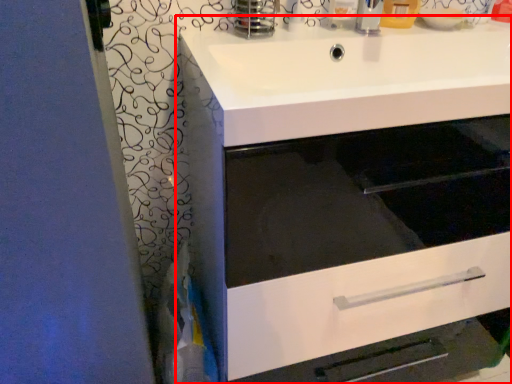
Question: From the image's perspective, what is the correct spatial positioning of bathroom cabinet (annotated by the red box) in reference to sink?

Choices:
 (A) above
 (B) below

Answer: (B)